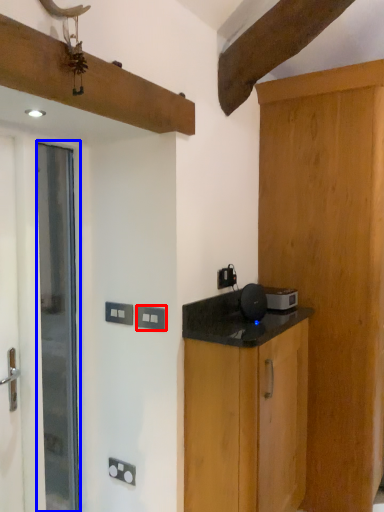
Question: Which object appears farthest to the camera in this image, electric outlet (highlighted by a red box) or door (highlighted by a blue box)?

Choices:
 (A) electric outlet
 (B) door

Answer: (A)